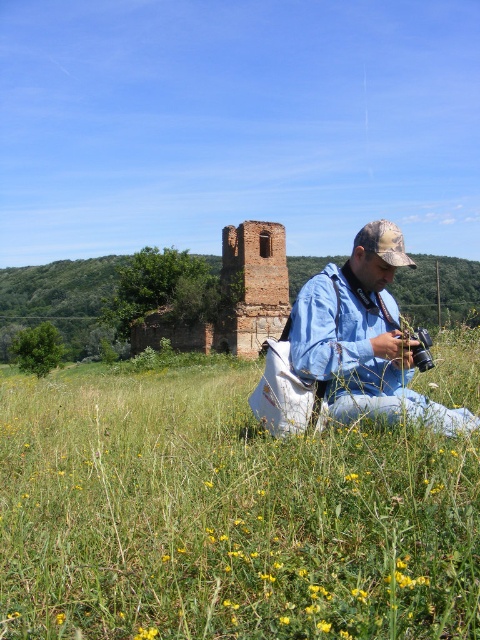
You are a photographer standing in the middle of the green grass at center and the blue denim jacket at center. You want to place a small tripod between them. Where should you place it so that it is exactly halfway between the two objects?

The green grass at center is located below the blue denim jacket at center, so placing the tripod halfway between them would mean positioning it directly between the green grass at center and the blue denim jacket at center along the vertical axis.

You are a hiker who has just arrived at this peaceful outdoor location. You notice a blue denim jacket at center and a brown brick ruins at center. If you want to place a 60 meter long tent between them, will there be enough space?

The distance between the blue denim jacket at center and brown brick ruins at center is 63.61 meters, so yes, there is enough space to place a 60 meter long tent between them since the distance is greater than the tent length.